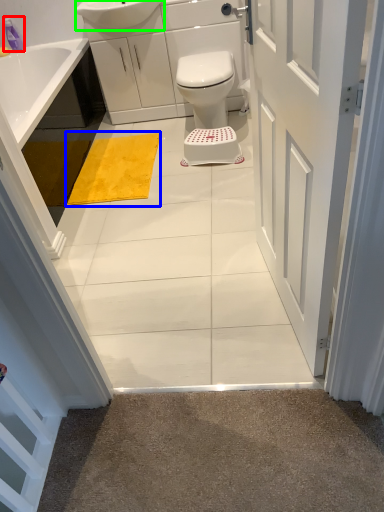
Question: Considering the real-world distances, which object is farthest from toiletry (highlighted by a red box)? bath mat (highlighted by a blue box) or sink (highlighted by a green box)?

Choices:
 (A) bath mat
 (B) sink

Answer: (A)